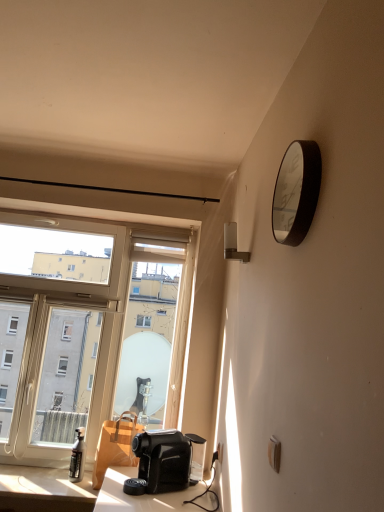
Question: Could transparent glass window at left be considered to be inside matte black spray bottle at lower left?

Choices:
 (A) no
 (B) yes

Answer: (A)

Question: Does matte black spray bottle at lower left have a lesser width compared to transparent glass window at left?

Choices:
 (A) no
 (B) yes

Answer: (A)

Question: Does matte black spray bottle at lower left have a lesser height compared to transparent glass window at left?

Choices:
 (A) no
 (B) yes

Answer: (B)

Question: Would you say matte black spray bottle at lower left is a long distance from transparent glass window at left?

Choices:
 (A) no
 (B) yes

Answer: (A)

Question: Is matte black spray bottle at lower left positioned with its back to transparent glass window at left?

Choices:
 (A) yes
 (B) no

Answer: (A)

Question: Is matte black spray bottle at lower left facing towards transparent glass window at left?

Choices:
 (A) no
 (B) yes

Answer: (A)

Question: Would you say white plastic lamp at upper right is outside white plastic electric outlet at lower right?

Choices:
 (A) yes
 (B) no

Answer: (A)

Question: Considering the relative sizes of white plastic lamp at upper right and white plastic electric outlet at lower right in the image provided, is white plastic lamp at upper right taller than white plastic electric outlet at lower right?

Choices:
 (A) yes
 (B) no

Answer: (A)

Question: From a real-world perspective, does white plastic lamp at upper right sit lower than white plastic electric outlet at lower right?

Choices:
 (A) yes
 (B) no

Answer: (B)

Question: Would you say white plastic lamp at upper right contains white plastic electric outlet at lower right?

Choices:
 (A) yes
 (B) no

Answer: (B)

Question: Would you consider white plastic lamp at upper right to be distant from white plastic electric outlet at lower right?

Choices:
 (A) no
 (B) yes

Answer: (A)

Question: From the image's perspective, would you say white plastic lamp at upper right is shown under white plastic electric outlet at lower right?

Choices:
 (A) no
 (B) yes

Answer: (A)

Question: Is metallic silver clock at upper right facing away from transparent glass window at left?

Choices:
 (A) no
 (B) yes

Answer: (A)